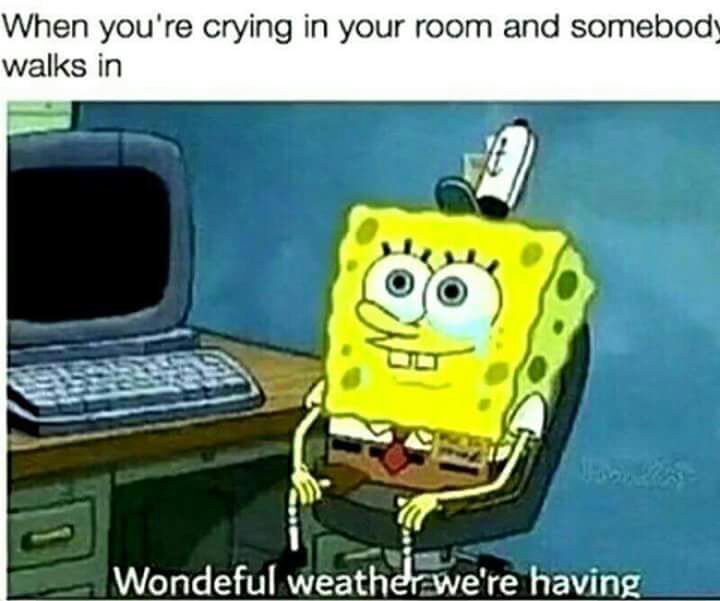
The height and width of the screenshot is (601, 720). Identify the location of drawer handle. (54, 532).